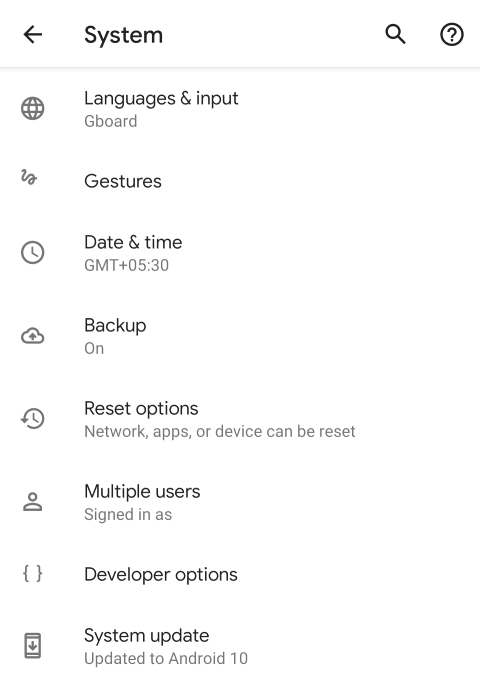
The width and height of the screenshot is (480, 689). I want to click on globe, so click(x=30, y=105).